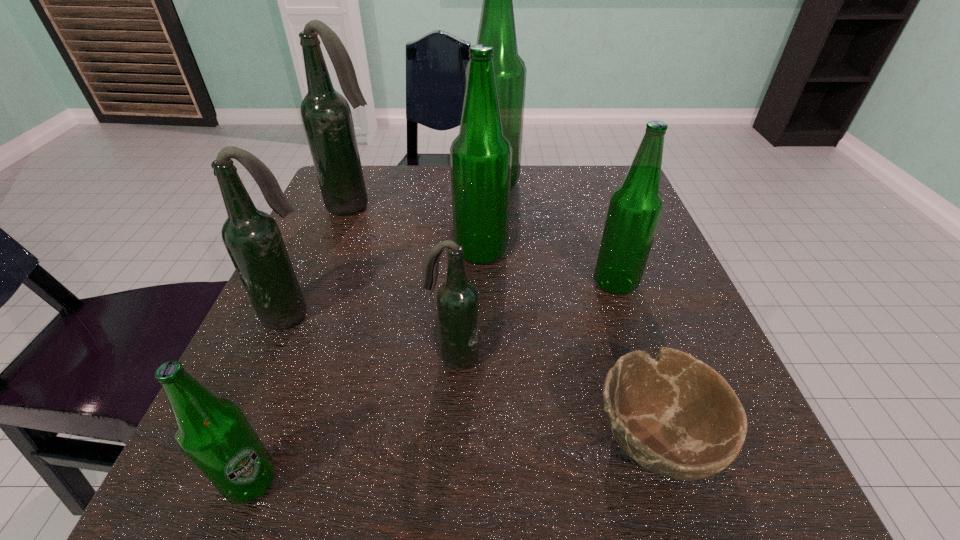
The height and width of the screenshot is (540, 960). In order to click on the biggest green beer bottle in this screenshot , I will do `click(497, 25)`.

This screenshot has width=960, height=540. What are the coordinates of `the farthest green beer bottle` in the screenshot? It's located at coord(497,25).

Image resolution: width=960 pixels, height=540 pixels. In order to click on the farthest dark beer bottle in this screenshot , I will do `click(326, 115)`.

At what (x,y) coordinates should I click in order to perform the action: click on the second biggest green beer bottle. Please return your answer as a coordinate pair (x, y). The image size is (960, 540). Looking at the image, I should click on (480, 156).

Image resolution: width=960 pixels, height=540 pixels. Find the location of `the second farthest green beer bottle`. the second farthest green beer bottle is located at coordinates (480, 156).

Locate an element on the screen. the second smallest green beer bottle is located at coordinates (636, 206).

The image size is (960, 540). In order to click on the second nearest green beer bottle in this screenshot , I will do `click(636, 206)`.

This screenshot has height=540, width=960. I want to click on the second nearest dark beer bottle, so click(x=252, y=238).

Where is `the sixth farthest object`? The image size is (960, 540). the sixth farthest object is located at coordinates (457, 299).

I want to click on the nearest dark beer bottle, so click(x=457, y=299).